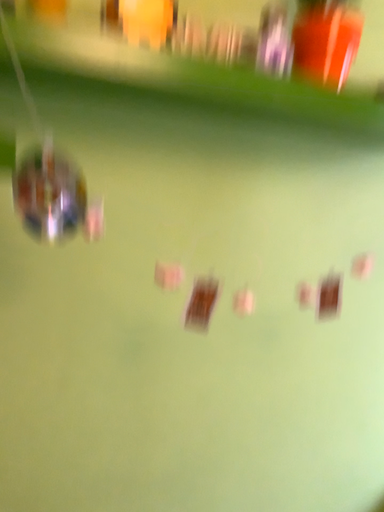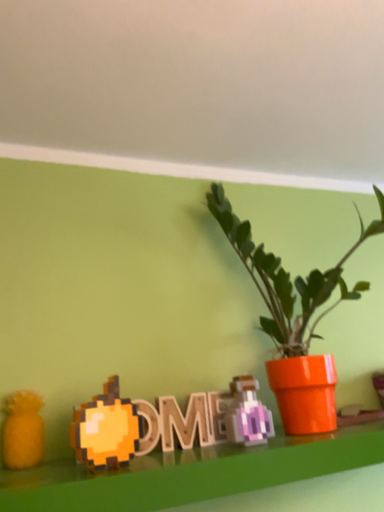
Question: How did the camera likely rotate when shooting the video?

Choices:
 (A) rotated upward
 (B) rotated downward

Answer: (A)